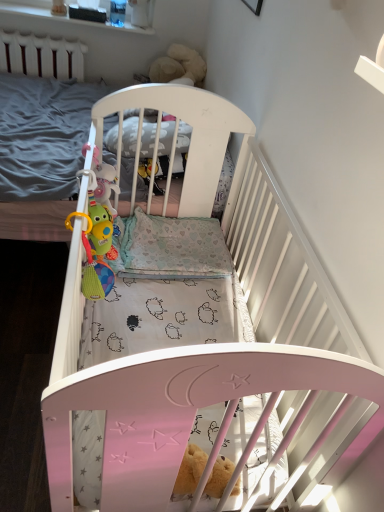
I want to click on white plastic changing table at upper left, so click(44, 14).

Describe the element at coordinates (44, 14) in the screenshot. I see `white plastic changing table at upper left` at that location.

Consider the image. What is the approximate width of white plastic changing table at upper left?

The width of white plastic changing table at upper left is 12.28 inches.

At what (x,y) coordinates should I click in order to perform the action: click on white plastic changing table at upper left. Please return your answer as a coordinate pair (x, y). Image resolution: width=384 pixels, height=512 pixels. Looking at the image, I should click on (44, 14).